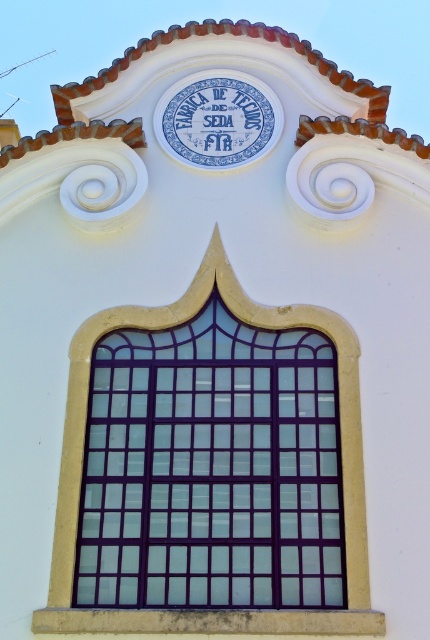
Question: Among these objects, which one is farthest from the camera?

Choices:
 (A) purple glass window at center
 (B) blue ceramic sign at center

Answer: (B)

Question: Does purple glass window at center have a greater width compared to blue ceramic sign at center?

Choices:
 (A) no
 (B) yes

Answer: (B)

Question: Is purple glass window at center smaller than blue ceramic sign at center?

Choices:
 (A) yes
 (B) no

Answer: (B)

Question: Which point appears closest to the camera in this image?

Choices:
 (A) (183, 506)
 (B) (237, 93)

Answer: (A)

Question: Can you confirm if purple glass window at center is positioned below blue ceramic sign at center?

Choices:
 (A) yes
 (B) no

Answer: (A)

Question: Which of the following is the farthest from the observer?

Choices:
 (A) (270, 99)
 (B) (106, 346)

Answer: (A)